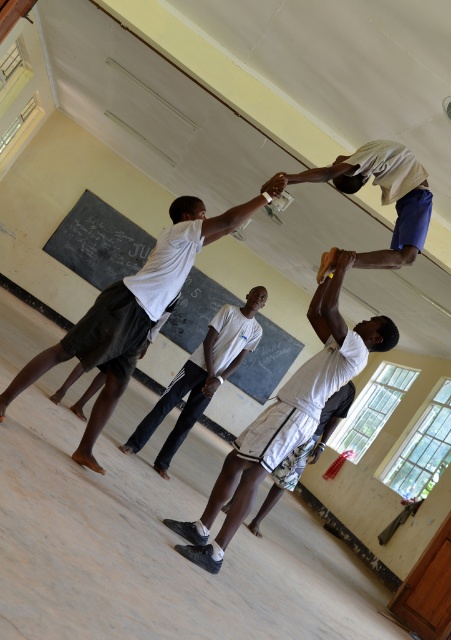
You are a student standing in the classroom and notice the white matte shorts at center and the black chalkboard at upper center. Which object is located closer to the floor?

The white matte shorts at center is positioned under the black chalkboard at upper center, so it is closer to the floor than the chalkboard.

You are standing at point (x=230, y=308) and want to move to the door located at the back of the classroom. Can you walk directly towards the door without passing through point (x=130, y=244)?

Point (x=130, y=244) is behind point (x=230, y=308), so if you are at point (x=230, y=308) and move towards the door at the back, you would not pass through point (x=130, y=244) since it is already behind your current position.